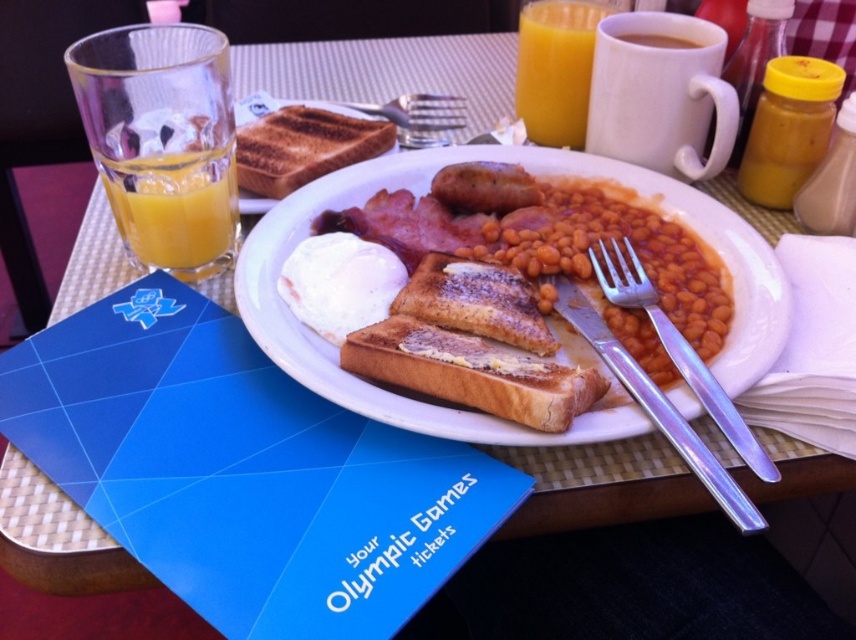
Question: Which point is closer to the camera taking this photo?

Choices:
 (A) (467, 200)
 (B) (785, 97)
 (C) (152, 176)

Answer: (C)

Question: Can you confirm if white glazed plate at center is positioned to the left of translucent glass mug at upper center?

Choices:
 (A) no
 (B) yes

Answer: (B)

Question: Can you confirm if translucent glass mug at upper center is smaller than translucent glass at upper left?

Choices:
 (A) yes
 (B) no

Answer: (B)

Question: Which is nearer to the translucent glass at left?

Choices:
 (A) white glazed plate at center
 (B) translucent glass mug at upper center
 (C) translucent glass at upper left

Answer: (A)

Question: Does brown matte sausage at center have a larger size compared to silver metallic fork at center?

Choices:
 (A) yes
 (B) no

Answer: (B)

Question: Which point is farther from the camera taking this photo?

Choices:
 (A) (679, 48)
 (B) (119, 164)
 (C) (727, 365)
 (D) (382, 108)

Answer: (D)